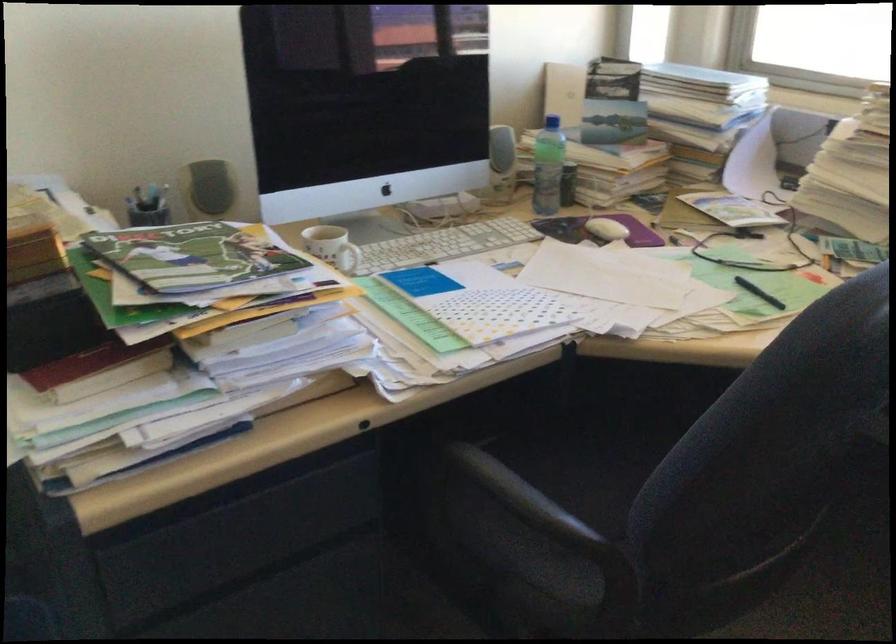
Locate an element on the screen. This screenshot has width=896, height=644. black chair armrest is located at coordinates (532, 506).